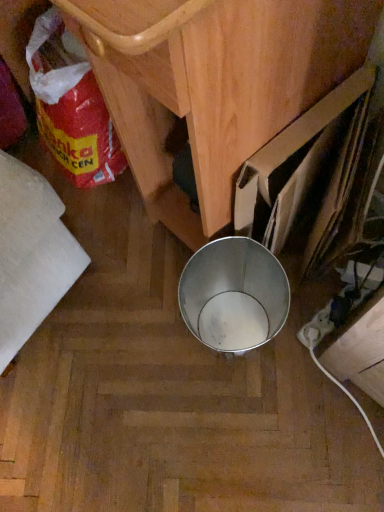
Question: Is metallic bucket at center far from red plastic bag at lower left?

Choices:
 (A) yes
 (B) no

Answer: (B)

Question: Can you confirm if metallic bucket at center is taller than red plastic bag at lower left?

Choices:
 (A) yes
 (B) no

Answer: (A)

Question: From a real-world perspective, is metallic bucket at center located higher than red plastic bag at lower left?

Choices:
 (A) yes
 (B) no

Answer: (A)

Question: Considering the relative sizes of metallic bucket at center and red plastic bag at lower left in the image provided, is metallic bucket at center bigger than red plastic bag at lower left?

Choices:
 (A) yes
 (B) no

Answer: (A)

Question: Is metallic bucket at center at the right side of red plastic bag at lower left?

Choices:
 (A) yes
 (B) no

Answer: (A)

Question: Is metallic bucket at center looking in the opposite direction of red plastic bag at lower left?

Choices:
 (A) no
 (B) yes

Answer: (B)

Question: Can you confirm if red plastic bag at lower left is taller than metallic bucket at center?

Choices:
 (A) no
 (B) yes

Answer: (A)

Question: Is red plastic bag at lower left not within metallic bucket at center?

Choices:
 (A) no
 (B) yes

Answer: (A)

Question: Would you say red plastic bag at lower left contains metallic bucket at center?

Choices:
 (A) no
 (B) yes

Answer: (A)

Question: Is red plastic bag at lower left far from metallic bucket at center?

Choices:
 (A) no
 (B) yes

Answer: (A)

Question: Can you confirm if red plastic bag at lower left is thinner than metallic bucket at center?

Choices:
 (A) no
 (B) yes

Answer: (B)

Question: Considering the relative positions of red plastic bag at lower left and metallic bucket at center in the image provided, is red plastic bag at lower left to the right of metallic bucket at center from the viewer's perspective?

Choices:
 (A) yes
 (B) no

Answer: (B)

Question: Is metallic bucket at center in front of or behind red plastic bag at lower left in the image?

Choices:
 (A) behind
 (B) front

Answer: (B)